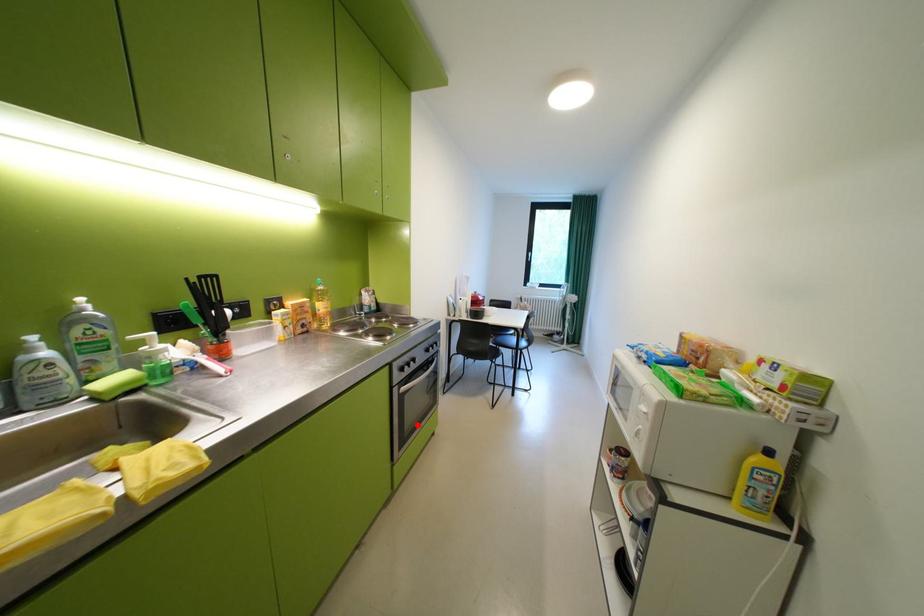
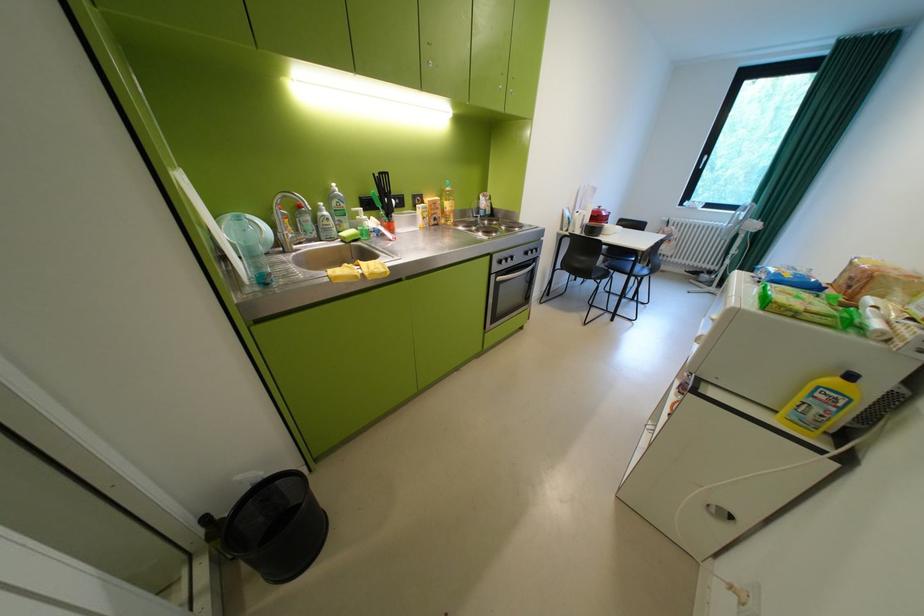
The point at the highlighted location is marked in the first image. Where is the corresponding point in the second image?

(511, 310)